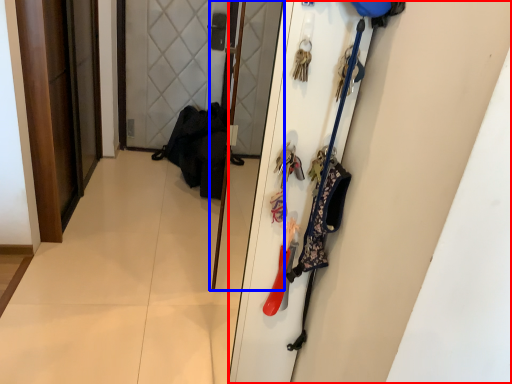
Question: Which point is further to the camera, door (highlighted by a red box) or screen door (highlighted by a blue box)?

Choices:
 (A) door
 (B) screen door

Answer: (B)